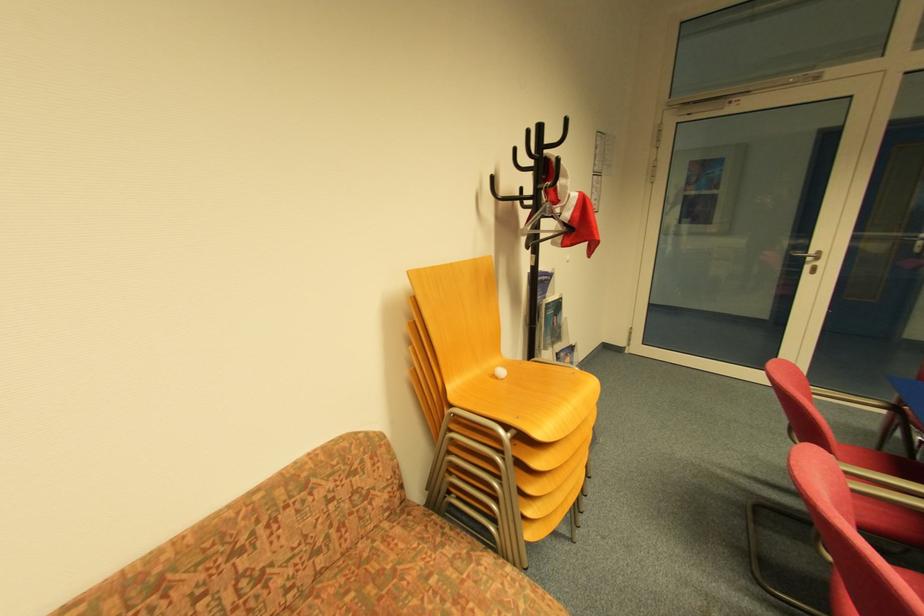
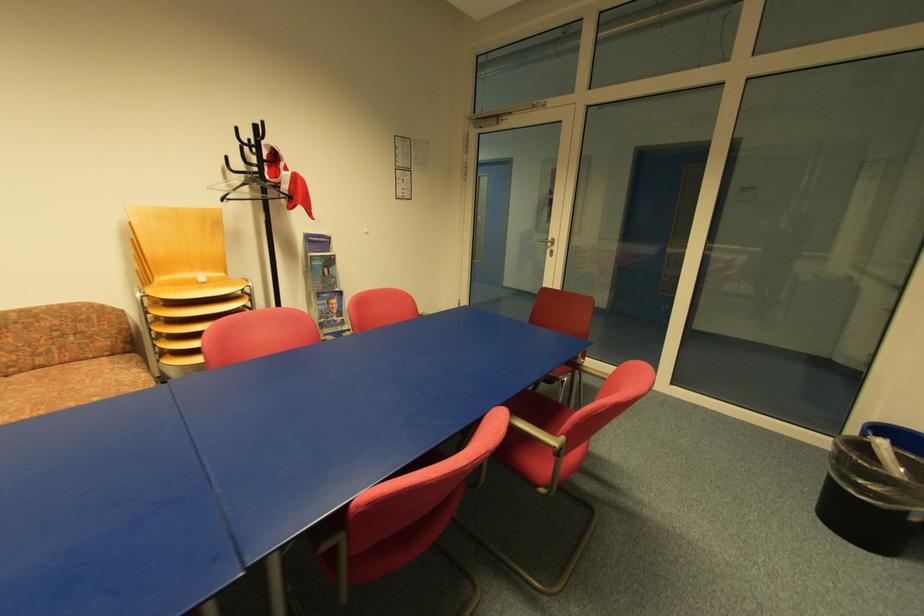
Locate, in the second image, the point that corresponds to point (570, 224) in the first image.

(292, 193)